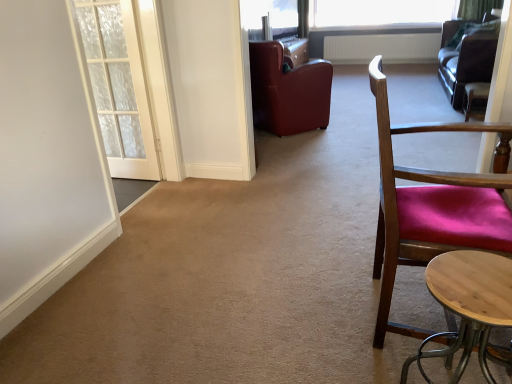
Identify the location of vacant region under wooden chair with red cushion at right, which appears as the 2th chair when viewed from the left (from a real-world perspective). This screenshot has height=384, width=512. (418, 322).